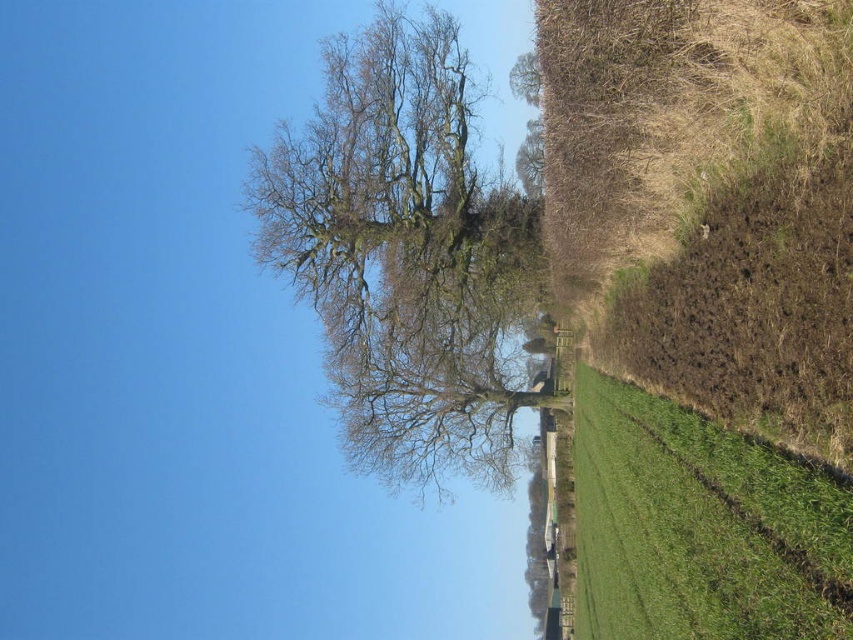
You are standing at the center of the image and want to locate the bare branches tree at center. According to the coordinates provided, in which direction should you look to find it?

The bare branches tree at center is located at coordinates point (404,253), which is slightly to the left and slightly below the exact center of the image. Since you are at the center, you should look slightly to your left and slightly downward to locate it.

You are standing at the point labeled point [404,253] in the image. Which direction should you walk to reach the grassy field with the dark line?

The point [404,253] is located at the bare branches tree at center. The grassy field with the dark line is to the right of the tree. Therefore, you should walk to the right to reach the grassy field with the dark line.

You are planning to place a large picnic blanket on the green grassy field at right. Considering the space available, will the bare branches tree at center cast a shadow over the entire field during midday when the sun is directly overhead?

The bare branches tree at center might be wider than green grassy field at right, so its shadow could potentially cover the entire field during midday when the sun is high overhead.